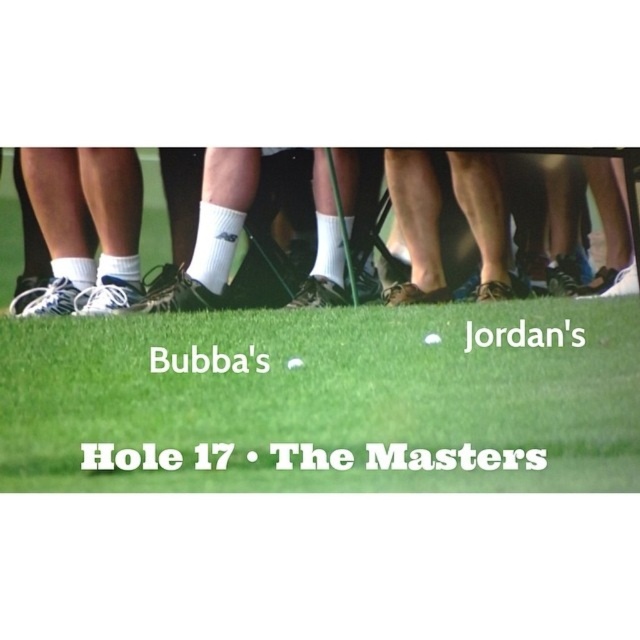
You are a golfer standing at the tee box and see the point marked at coordinates (324, 401). What object is located at that point?

The point at coordinates (324, 401) marks the white smooth golf ball at center.

Looking at this image, you are a golf ball manufacturer inspector. You have two golf balls in front of you, the white smooth golf ball at center and the white matte golf ball at center. According to the USGA regulations, all golf balls must have a diameter of at least 1.68 inches. Which golf ball meets the minimum height requirement?

The white smooth golf ball at center is taller than the white matte golf ball at center, so it meets the minimum height requirement.

You are a golf caddy observing the scene. There are two golf balls on the ground in front of you. Which one is positioned to the right side between the white smooth golf ball at center and the white matte golf ball at center?

The white smooth golf ball at center is positioned to the right of the white matte golf ball at center.